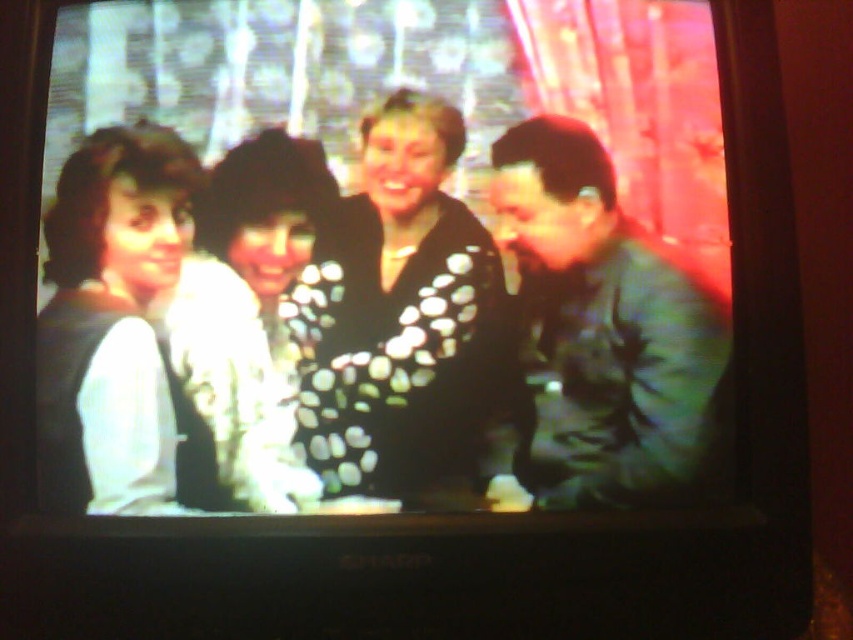
Which is more to the left, matte black sweater at center or black dotted sweater at center?

matte black sweater at center is more to the left.

Does matte black sweater at center appear on the left side of black dotted sweater at center?

Yes, matte black sweater at center is to the left of black dotted sweater at center.

Image resolution: width=853 pixels, height=640 pixels. What do you see at coordinates (409, 250) in the screenshot?
I see `matte black sweater at center` at bounding box center [409, 250].

Where is `matte black sweater at center`? matte black sweater at center is located at coordinates (409, 250).

Which is in front, point (560, 157) or point (233, 356)?

Positioned in front is point (233, 356).

Is point (679, 477) less distant than point (286, 413)?

No, it is behind (286, 413).

Where is `green matte jacket at right`? The width and height of the screenshot is (853, 640). green matte jacket at right is located at coordinates (602, 330).

Consider the image. Does black matte vest at left come in front of white dotted sweater at center?

No, it is not.

The image size is (853, 640). What are the coordinates of `black matte vest at left` in the screenshot? It's located at (117, 330).